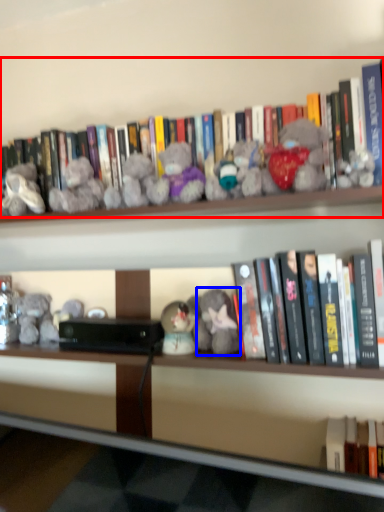
Question: Among these objects, which one is farthest to the camera, book (highlighted by a red box) or toy (highlighted by a blue box)?

Choices:
 (A) book
 (B) toy

Answer: (B)